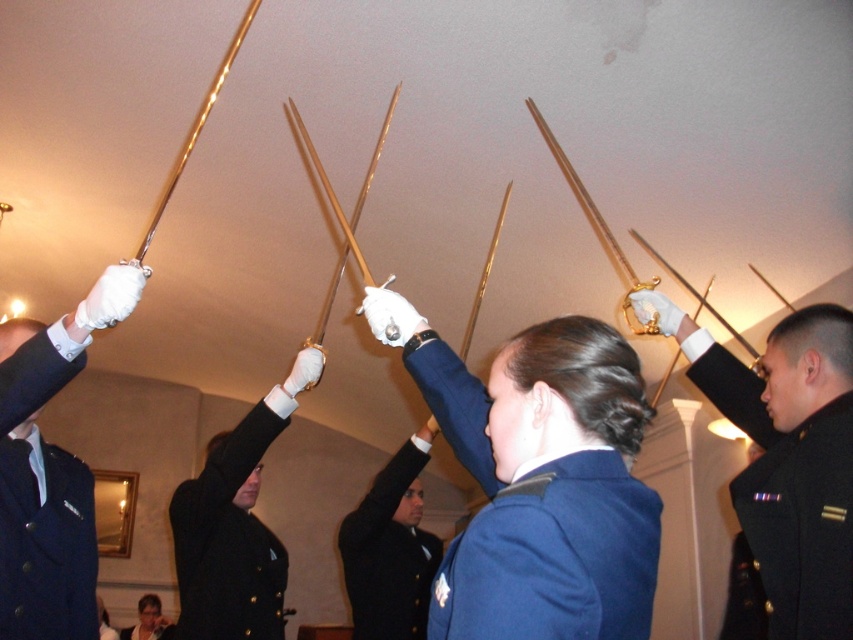
Between point (653, 531) and point (389, 484), which one is positioned behind?

Point (389, 484)

In order to click on blue fabric uniform at center in this screenshot , I will do `click(537, 528)`.

Is shiny black uniform at upper right below matte black hair at upper center?

No.

Which is behind, point (790, 320) or point (152, 611)?

Point (152, 611)

The width and height of the screenshot is (853, 640). What are the coordinates of `shiny black uniform at upper right` in the screenshot? It's located at (788, 458).

Which is below, gold polished sword at center or matte black hair at upper center?

Positioned lower is matte black hair at upper center.

Based on the photo, does gold polished sword at center have a smaller size compared to matte black hair at upper center?

Incorrect, gold polished sword at center is not smaller in size than matte black hair at upper center.

Is point (369, 173) farther from camera compared to point (166, 637)?

No, (369, 173) is in front of (166, 637).

Locate an element on the screen. The image size is (853, 640). gold polished sword at center is located at coordinates (x=373, y=160).